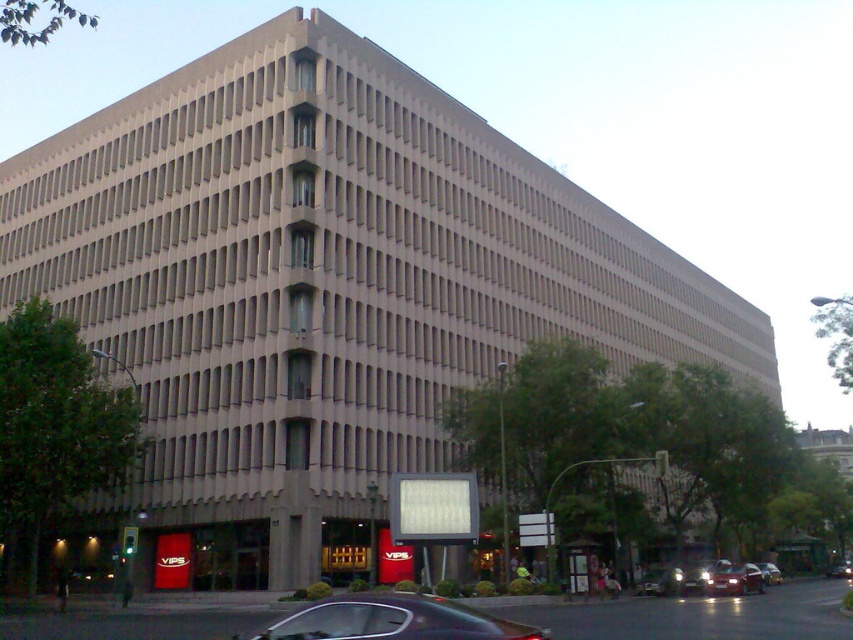
You are a pedestrian standing at the entrance of the building. You see a shiny black sedan at lower center and a shiny silver car at center. Which car is closer to you?

The shiny black sedan at lower center is closer to you because it is positioned over the shiny silver car at center, indicating it is in front.

You are a delivery person trying to park your vehicle in the parking lot in front of the building. You see the shiny black sedan at lower center and the metallic silver car at center. Which car is parked closer to the entrance of the building?

The metallic silver car at center is parked closer to the entrance of the building because the shiny black sedan at lower center is located above it, meaning the metallic silver car is positioned lower and nearer to the entrance.